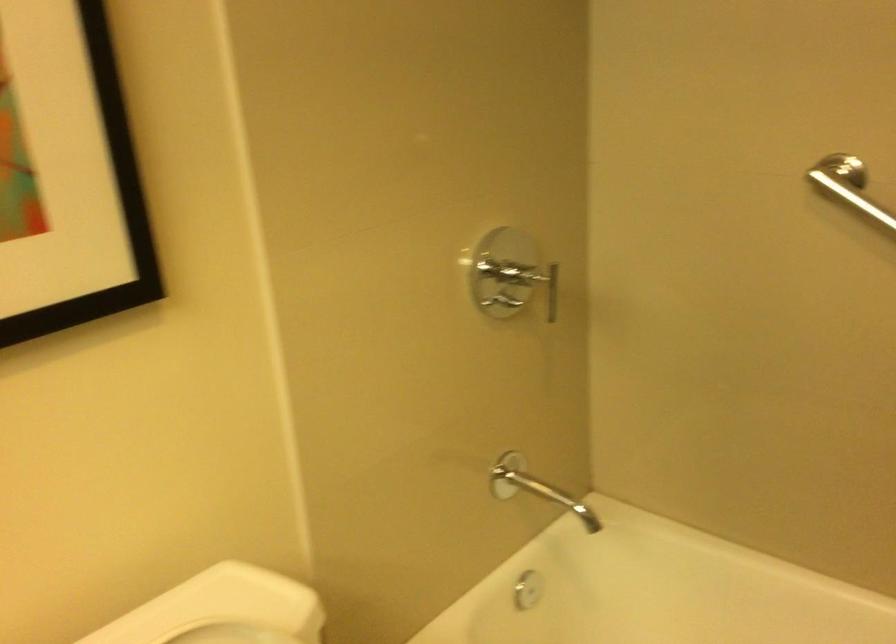
Identify the location of shower control handle. (549, 287).